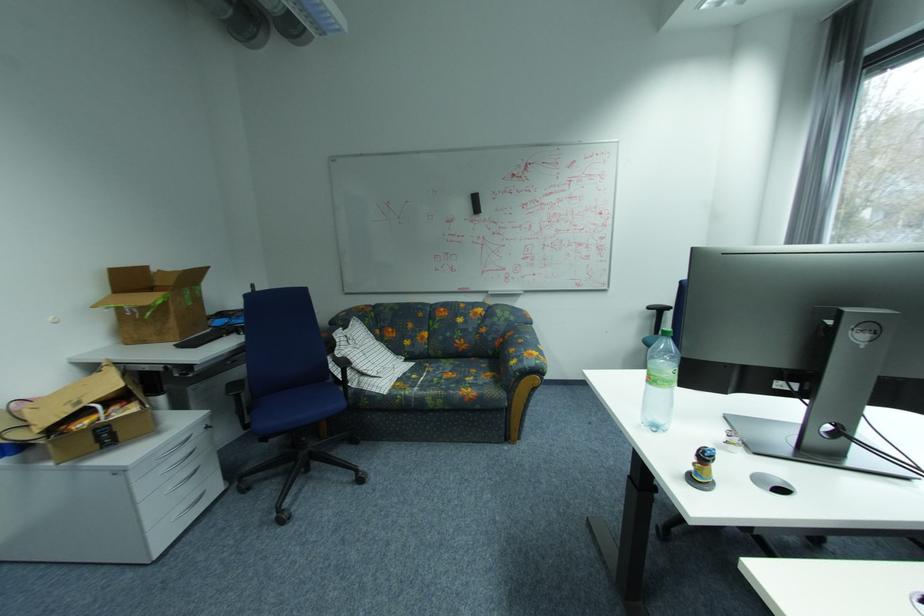
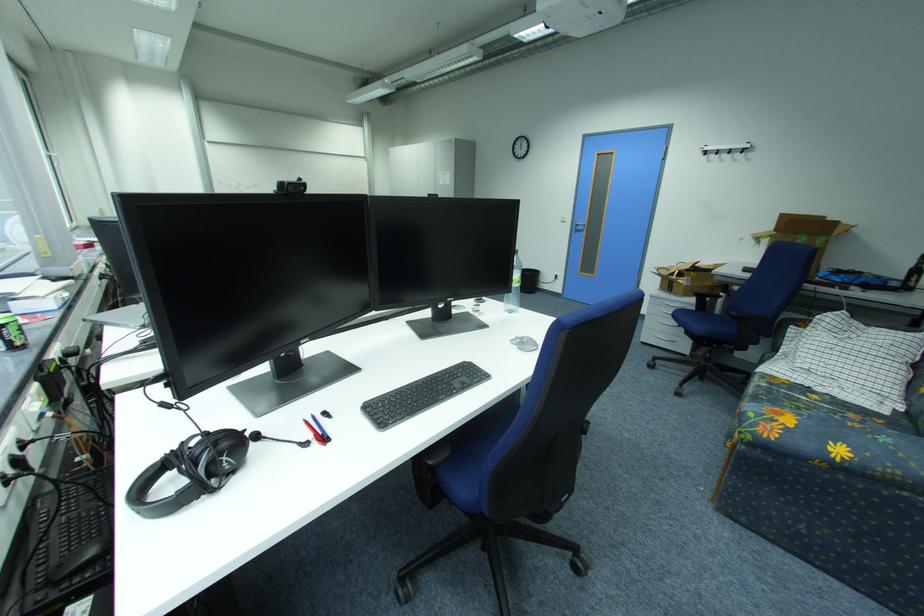
The point at (x=433, y=375) is marked in the first image. Where is the corresponding point in the second image?

(834, 407)